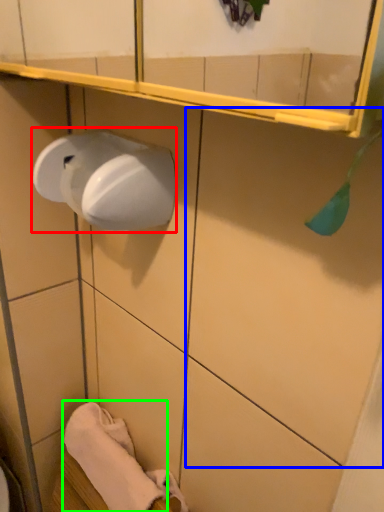
Question: Estimate the real-world distances between objects in this image. Which object is closer to paper towel (highlighted by a red box), tile (highlighted by a blue box) or bath towel (highlighted by a green box)?

Choices:
 (A) tile
 (B) bath towel

Answer: (A)